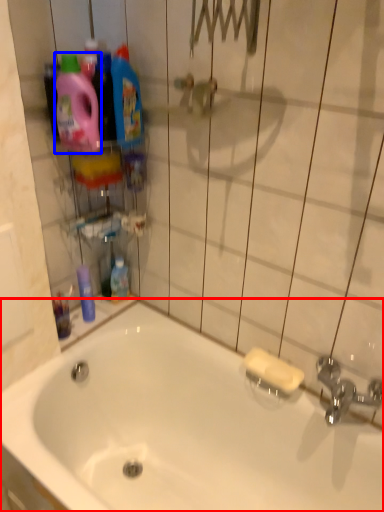
Question: Which object is closer to the camera taking this photo, bathtub (highlighted by a red box) or cleaning product (highlighted by a blue box)?

Choices:
 (A) bathtub
 (B) cleaning product

Answer: (A)